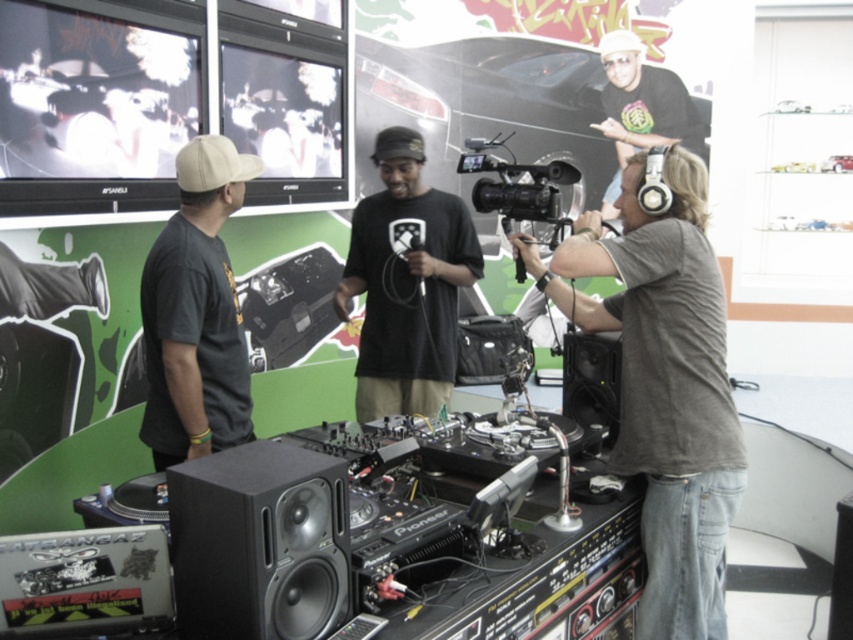
Is point (717, 324) farther from viewer compared to point (293, 568)?

Yes, point (717, 324) is behind point (293, 568).

I want to click on gray matte headphones at center, so click(664, 387).

Between white matte headphones at upper right and white matte baseball cap at upper left, which one appears on the left side from the viewer's perspective?

white matte baseball cap at upper left

Locate an element on the screen. The height and width of the screenshot is (640, 853). white matte headphones at upper right is located at coordinates pyautogui.click(x=641, y=106).

Can you confirm if black matte baseball cap at center is thinner than white matte baseball hat at upper center?

Indeed, black matte baseball cap at center has a lesser width compared to white matte baseball hat at upper center.

Is point (402, 145) positioned before point (637, 49)?

Yes.

Is point (404, 136) more distant than point (596, 51)?

No, (404, 136) is closer to viewer.

This screenshot has height=640, width=853. Identify the location of black matte baseball cap at center. (398, 145).